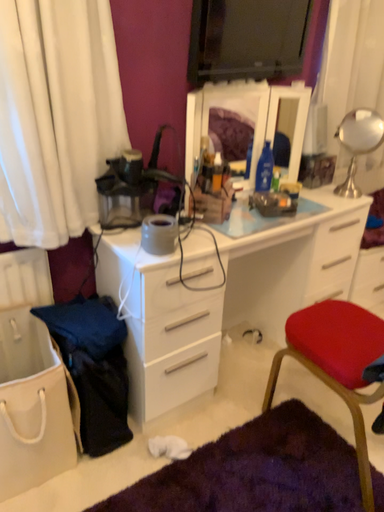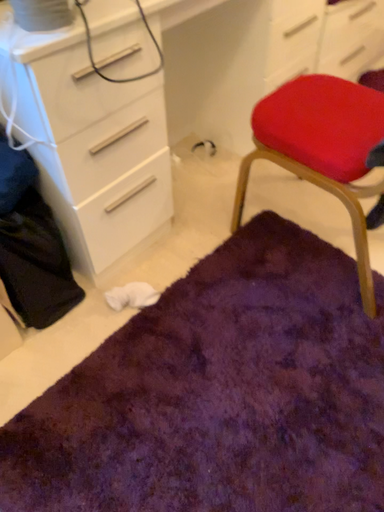
Question: Which way did the camera rotate in the video?

Choices:
 (A) rotated upward
 (B) rotated downward

Answer: (B)